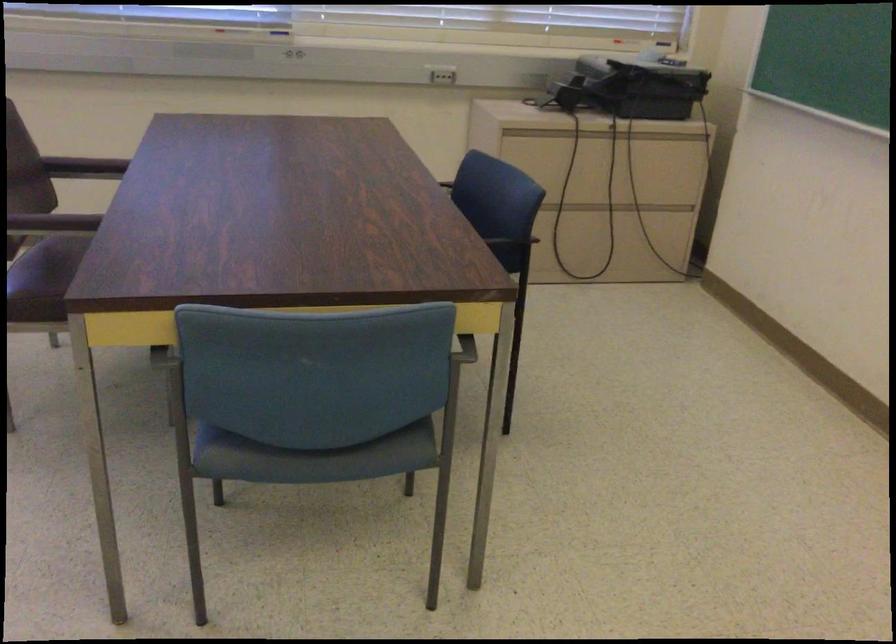
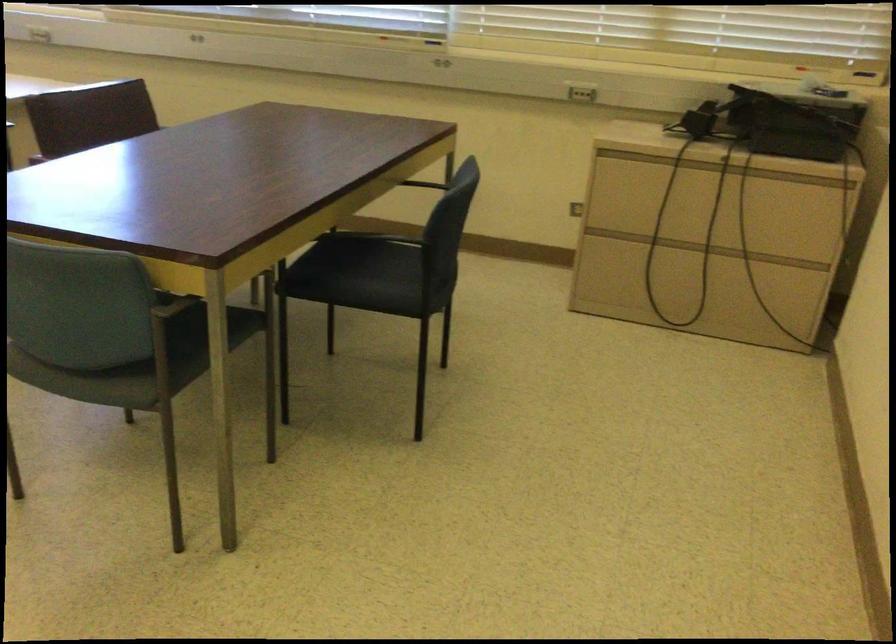
The point at (x=380, y=409) is marked in the first image. Where is the corresponding point in the second image?

(173, 359)